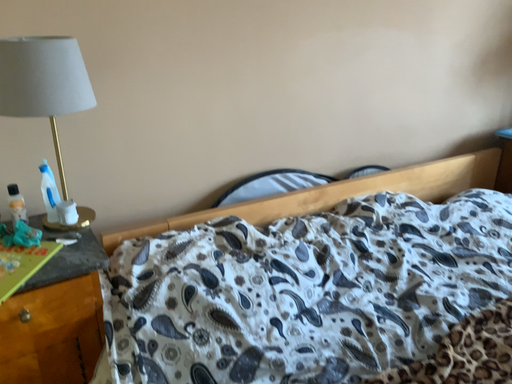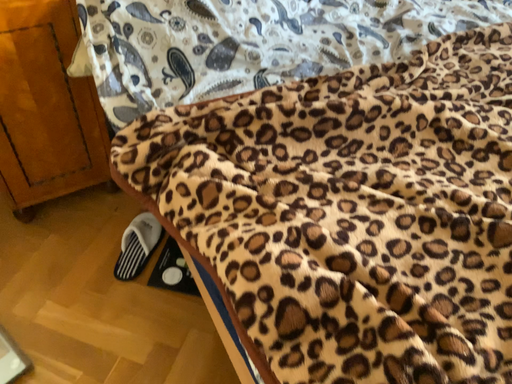
Question: Which way did the camera rotate in the video?

Choices:
 (A) rotated downward
 (B) rotated upward

Answer: (A)